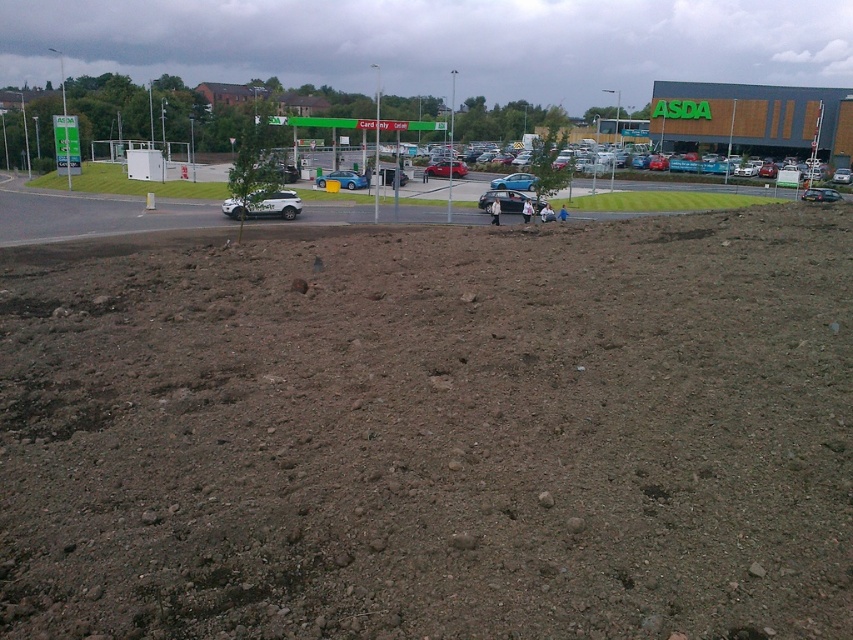
You are standing at the entrance of the ASDA supermarket and want to walk to the metallic blue sedan at center. Which direction should you head towards, away from the dull brown soil at center or towards it?

You should head away from the dull brown soil at center because the metallic blue sedan at center is further away from you than the soil, so moving away from the soil will bring you closer to the sedan.

You are standing at the point marked by the coordinates point (264, 205) in the ASDA supermarket retail area. Looking around, you see the white matte car at center. What is the closest object to you in this scene?

The closest object to you at point (264, 205) is the white matte car at center since the coordinates mark its location.